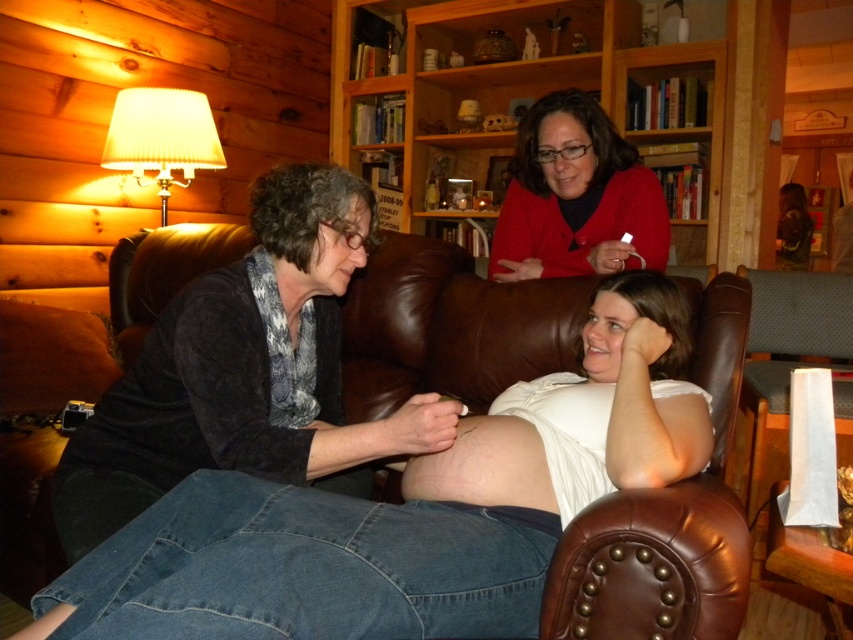
Which of these two, wooden bookshelf at upper center or matte red sweater at upper center, stands shorter?

matte red sweater at upper center is shorter.

Which is more to the right, wooden bookshelf at upper center or matte red sweater at upper center?

From the viewer's perspective, wooden bookshelf at upper center appears more on the right side.

The height and width of the screenshot is (640, 853). Find the location of `wooden bookshelf at upper center`. wooden bookshelf at upper center is located at coordinates (517, 88).

Can you confirm if dark gray sweater at center is positioned above wooden bookshelf at upper center?

No.

Can you confirm if dark gray sweater at center is taller than wooden bookshelf at upper center?

In fact, dark gray sweater at center may be shorter than wooden bookshelf at upper center.

Where is `dark gray sweater at center`? The width and height of the screenshot is (853, 640). dark gray sweater at center is located at coordinates (247, 371).

Between brown leather couch at center and matte red sweater at upper center, which one is positioned higher?

matte red sweater at upper center is higher up.

Who is lower down, brown leather couch at center or matte red sweater at upper center?

brown leather couch at center is below.

Locate an element on the screen. brown leather couch at center is located at coordinates (x=450, y=326).

At what (x,y) coordinates should I click in order to perform the action: click on brown leather couch at center. Please return your answer as a coordinate pair (x, y). Image resolution: width=853 pixels, height=640 pixels. Looking at the image, I should click on (450, 326).